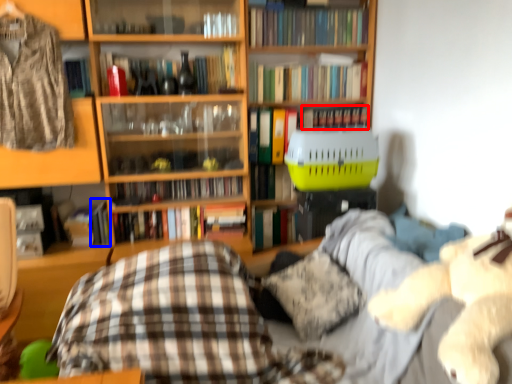
Question: Which point is closer to the camera, book (highlighted by a red box) or book (highlighted by a blue box)?

Choices:
 (A) book
 (B) book

Answer: (B)